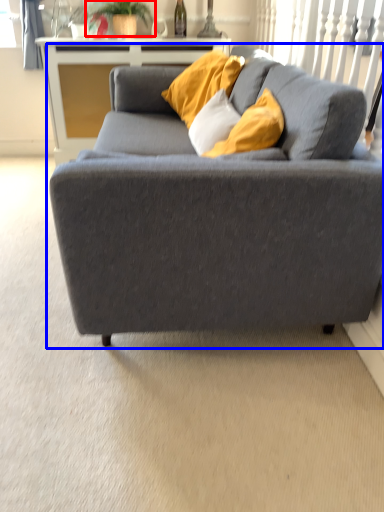
Question: Which object appears closest to the camera in this image, plant (highlighted by a red box) or studio couch (highlighted by a blue box)?

Choices:
 (A) plant
 (B) studio couch

Answer: (B)